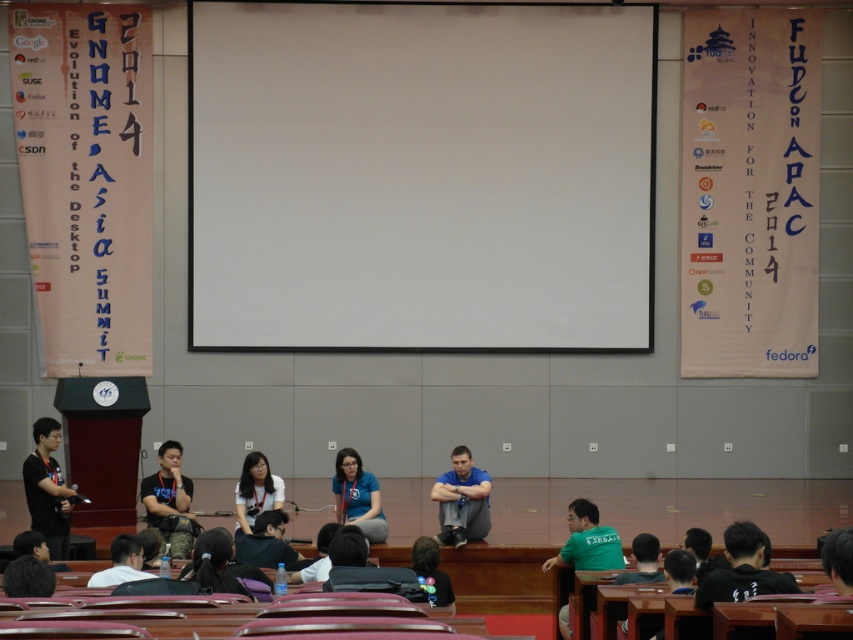
Does black matte shirt at lower right come behind matte black shirt at center?

No.

Does point (792, 593) lie behind point (160, 452)?

No, it is in front of (160, 452).

Is point (728, 552) closer to viewer compared to point (160, 481)?

Yes.

Locate an element on the screen. The height and width of the screenshot is (640, 853). black matte shirt at lower right is located at coordinates (741, 570).

Can you confirm if blue fabric pants at center is wider than matte black jacket at center?

No.

Does point (483, 536) come in front of point (271, 548)?

No.

At what (x,y) coordinates should I click in order to perform the action: click on blue fabric pants at center. Please return your answer as a coordinate pair (x, y). This screenshot has width=853, height=640. Looking at the image, I should click on (461, 500).

The image size is (853, 640). Identify the location of blue fabric pants at center. (461, 500).

Is green matte shirt at lower right taller than matte white shirt at center?

No.

Is green matte shirt at lower right to the right of matte white shirt at center from the viewer's perspective?

Yes, green matte shirt at lower right is to the right of matte white shirt at center.

What do you see at coordinates (587, 541) in the screenshot?
I see `green matte shirt at lower right` at bounding box center [587, 541].

Find the location of `green matte shirt at lower right`. green matte shirt at lower right is located at coordinates click(587, 541).